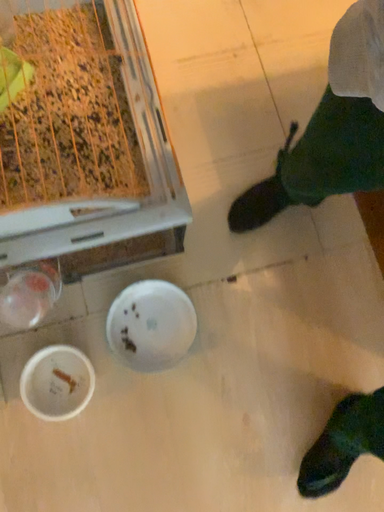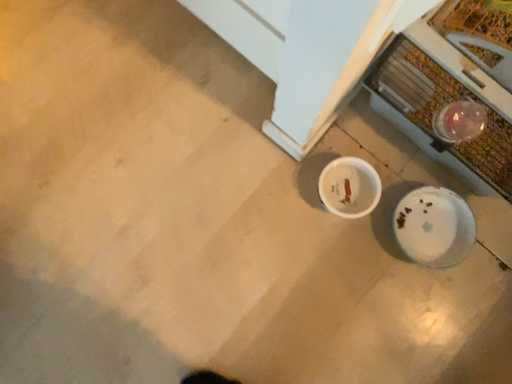
Question: Which way did the camera rotate in the video?

Choices:
 (A) rotated right
 (B) rotated left

Answer: (B)